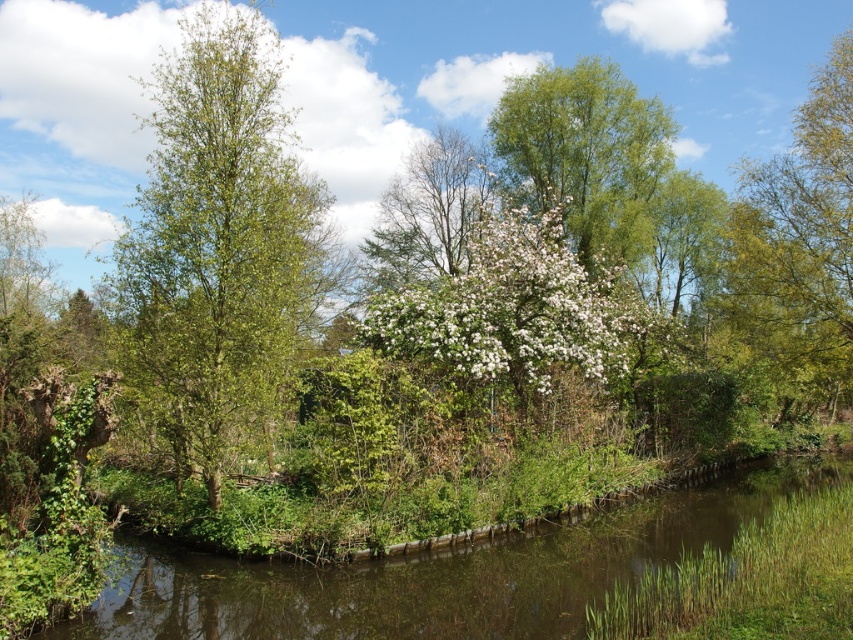
You are standing at the stone wall next to the river and see two points marked in the scene. Which point is closer to you, point (x=802, y=276) or point (x=451, y=172)?

Point (x=802, y=276) is in front of point (x=451, y=172), so it is closer to you.

From the picture: You are standing at the edge of the river and want to see both the green leafy tree at upper right and the white blossoming tree at center. Which tree would block your view of the other if you are looking from the river towards the trees?

The green leafy tree at upper right is in front of the white blossoming tree at center, so it would block your view of the white blossoming tree at center.

You are standing at the center of the scene and want to locate the green leafy tree at upper right. Based on the coordinates provided in the description, in which direction should you look to find it?

The green leafy tree at upper right is located at point coordinates that are to the right and above your current position, so you should look towards the upper right direction to find it.